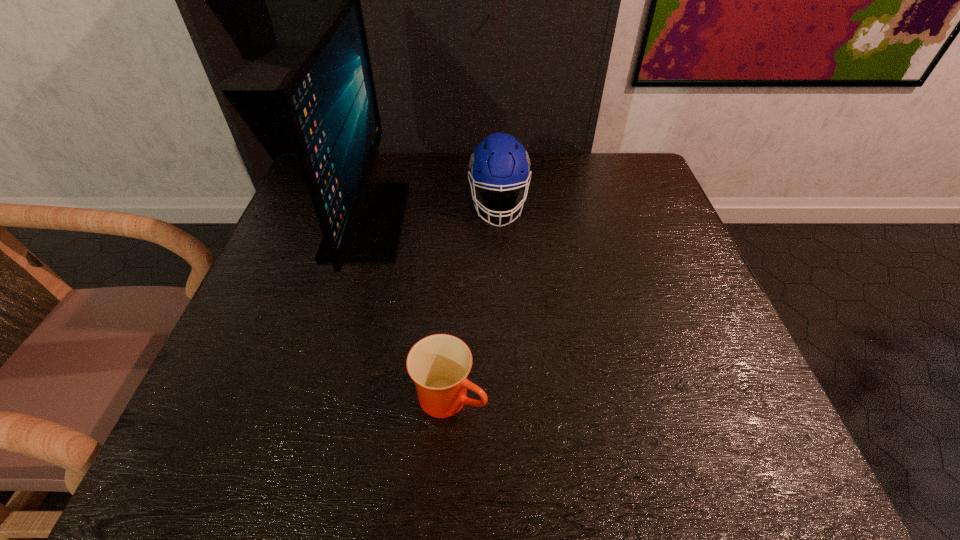
Identify the location of the tallest object. (328, 98).

The height and width of the screenshot is (540, 960). I want to click on monitor, so click(328, 98).

This screenshot has height=540, width=960. In order to click on football helmet in this screenshot , I will do `click(499, 162)`.

This screenshot has height=540, width=960. In order to click on cup in this screenshot , I will do `click(439, 364)`.

Image resolution: width=960 pixels, height=540 pixels. I want to click on the shortest object, so point(439,364).

I want to click on vacant space located on the screen side of the leftmost object, so click(x=476, y=221).

Image resolution: width=960 pixels, height=540 pixels. Find the location of `vacant space situated 0.400m on the front-facing side of the second shortest object`. vacant space situated 0.400m on the front-facing side of the second shortest object is located at coordinates (507, 379).

Identify the location of free region located 0.160m on the right of the cup. This screenshot has width=960, height=540. (581, 397).

This screenshot has height=540, width=960. In order to click on monitor situated at the far edge in this screenshot , I will do `click(328, 98)`.

The width and height of the screenshot is (960, 540). I want to click on football helmet that is at the far edge, so click(x=499, y=162).